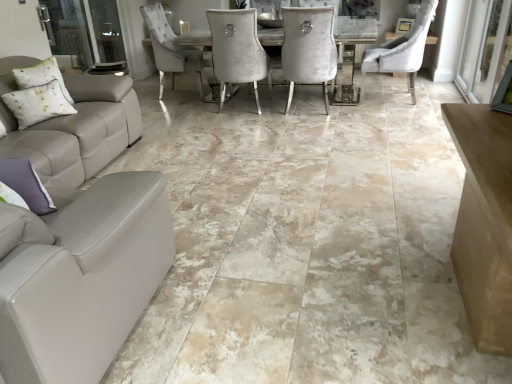
This screenshot has width=512, height=384. Find the location of `free space to the back side of velvet beige chair at center, the first chair when ordered from right to left`. free space to the back side of velvet beige chair at center, the first chair when ordered from right to left is located at coordinates (381, 86).